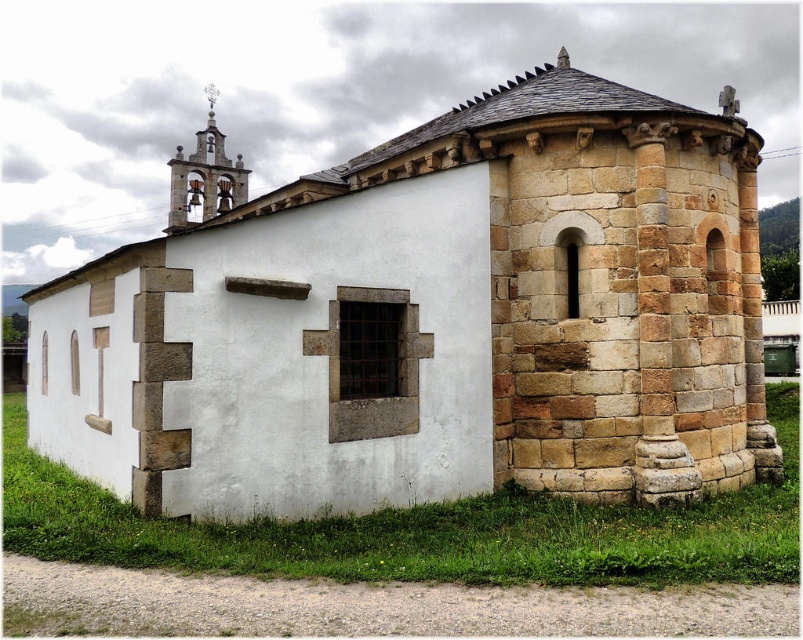
Which is more to the left, stone church at center or stone bell tower at upper left?

Positioned to the left is stone bell tower at upper left.

Does point (394, 349) lie behind point (206, 193)?

No, (394, 349) is in front of (206, 193).

The width and height of the screenshot is (803, 640). I want to click on stone church at center, so click(x=433, y=321).